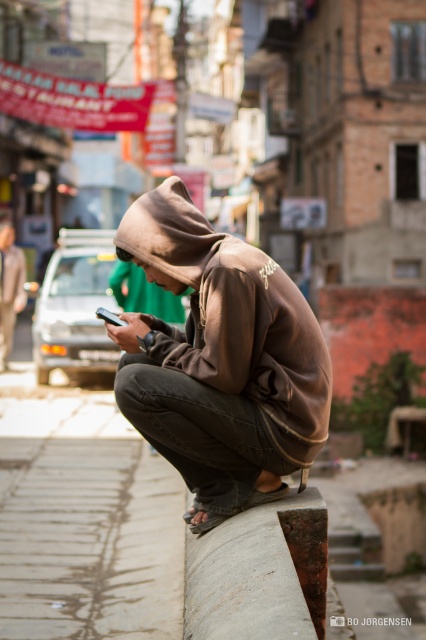
Question: Among these points, which one is farthest from the camera?

Choices:
 (A) tap(216, 566)
 (B) tap(9, 234)

Answer: (B)

Question: Is smooth concrete pavement at lower center to the right of rusty metal curb at lower center from the viewer's perspective?

Choices:
 (A) no
 (B) yes

Answer: (A)

Question: Which is farther from the brown cotton hoodie at center?

Choices:
 (A) smooth concrete pavement at lower center
 (B) brown matte hoodie at center

Answer: (B)

Question: From the image, what is the correct spatial relationship of brown matte hoodie at center in relation to brown cotton hoodie at center?

Choices:
 (A) left
 (B) right

Answer: (B)

Question: Which of the following is the closest to the observer?

Choices:
 (A) brown cotton hoodie at center
 (B) rusty metal curb at lower center

Answer: (B)

Question: Is smooth concrete pavement at lower center positioned behind brown cotton hoodie at center?

Choices:
 (A) yes
 (B) no

Answer: (B)